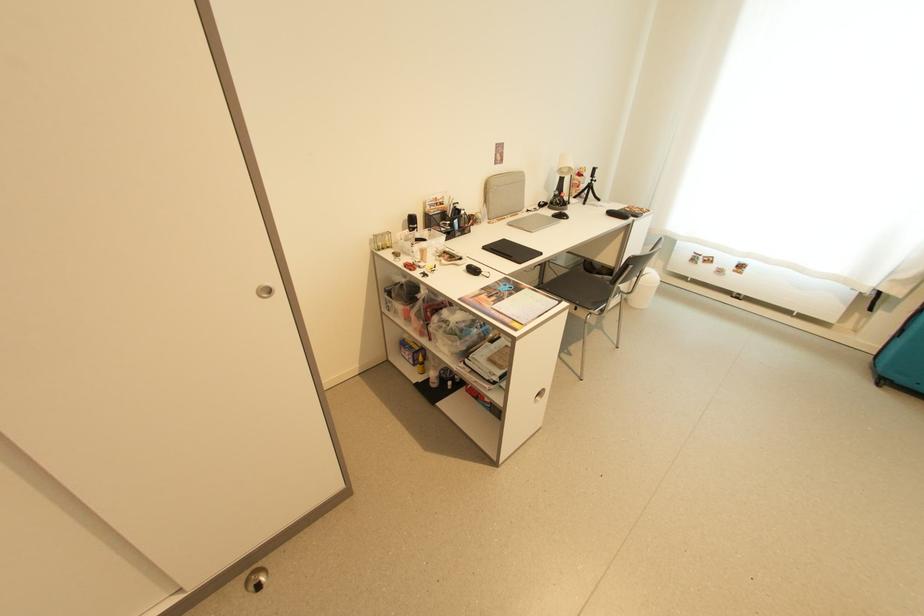
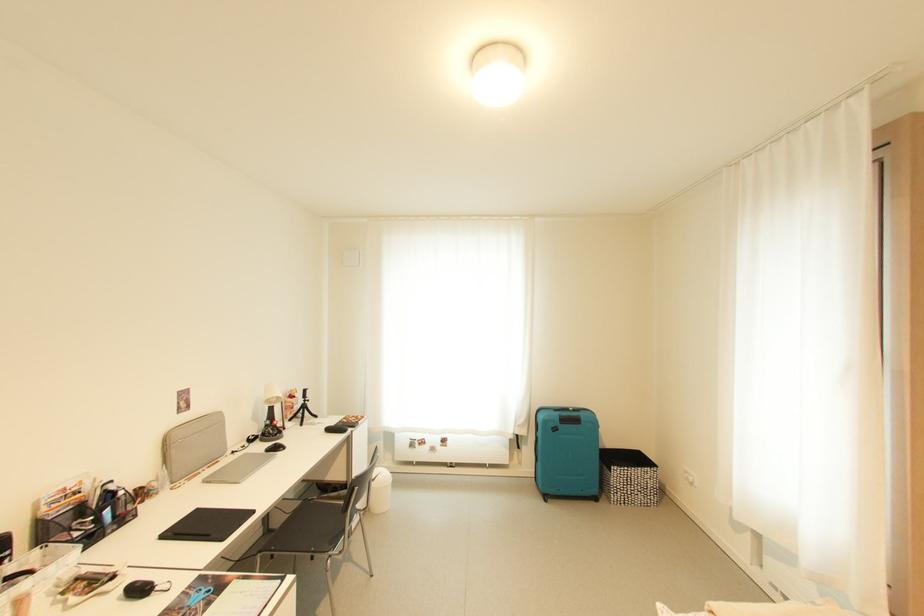
In the second image, find the point that corresponds to (x=566, y=217) in the first image.

(282, 450)